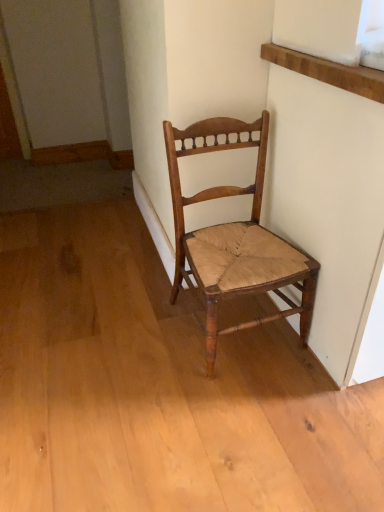
Where is `free space in front of natural wood chair at center`? This screenshot has width=384, height=512. free space in front of natural wood chair at center is located at coordinates (253, 414).